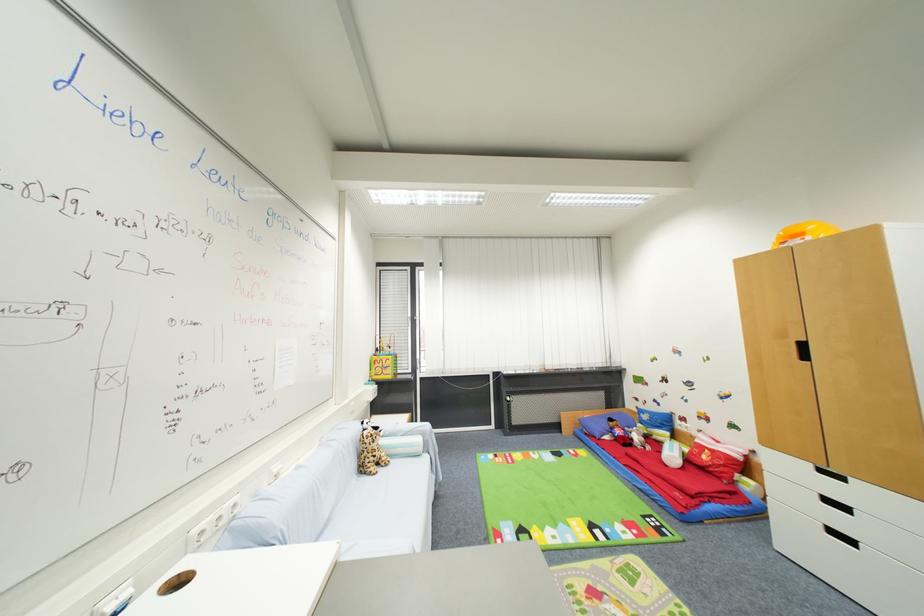
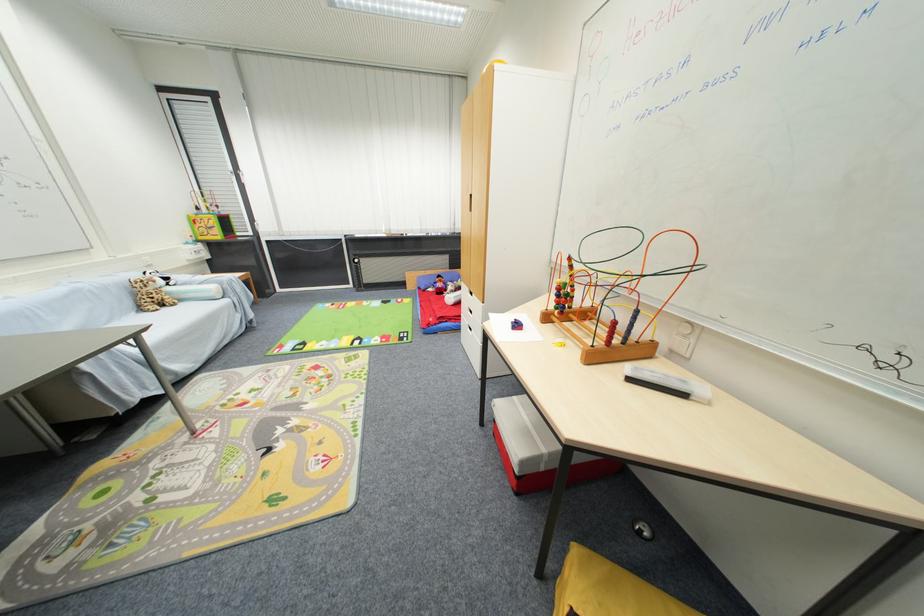
The point at (385, 472) is marked in the first image. Where is the corresponding point in the second image?

(171, 310)